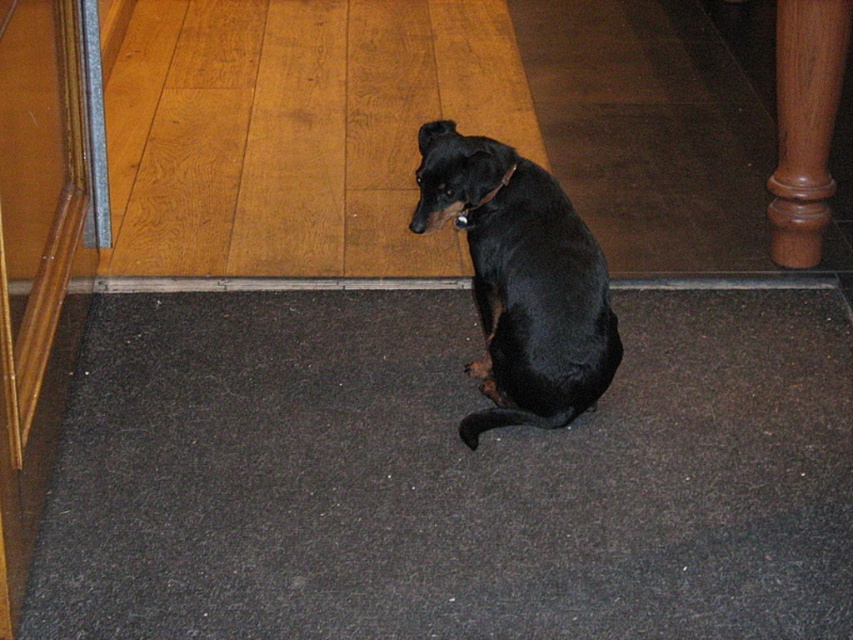
Between black smooth dog at center and brown leather neckband at center, which one is positioned lower?

black smooth dog at center is below.

Find the location of `black smooth dog at center`. black smooth dog at center is located at coordinates (521, 280).

You are a GUI agent. You are given a task and a screenshot of the screen. Output one action in this format:
    pyautogui.click(x=<x>, y=<y>)
    Task: Click on the black smooth dog at center
    
    Given the screenshot: What is the action you would take?
    pyautogui.click(x=521, y=280)